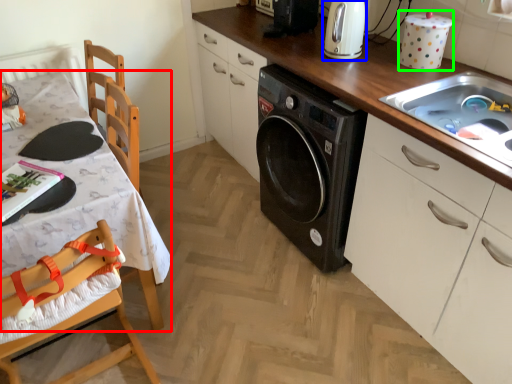
Question: Based on their relative distances, which object is farther from table (highlighted by a red box)? Choose from home appliance (highlighted by a blue box) and appliance (highlighted by a green box).

Choices:
 (A) home appliance
 (B) appliance

Answer: (B)